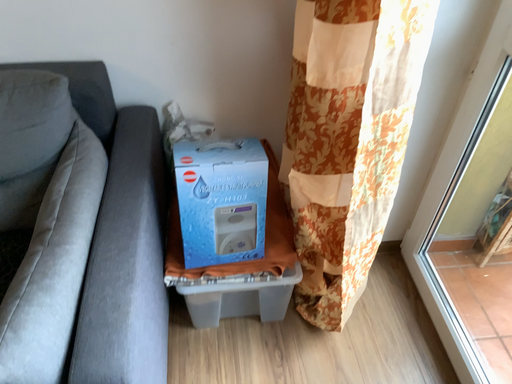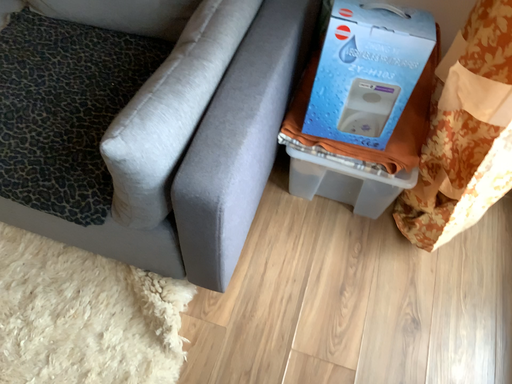
Question: Which way did the camera rotate in the video?

Choices:
 (A) rotated upward
 (B) rotated downward

Answer: (B)